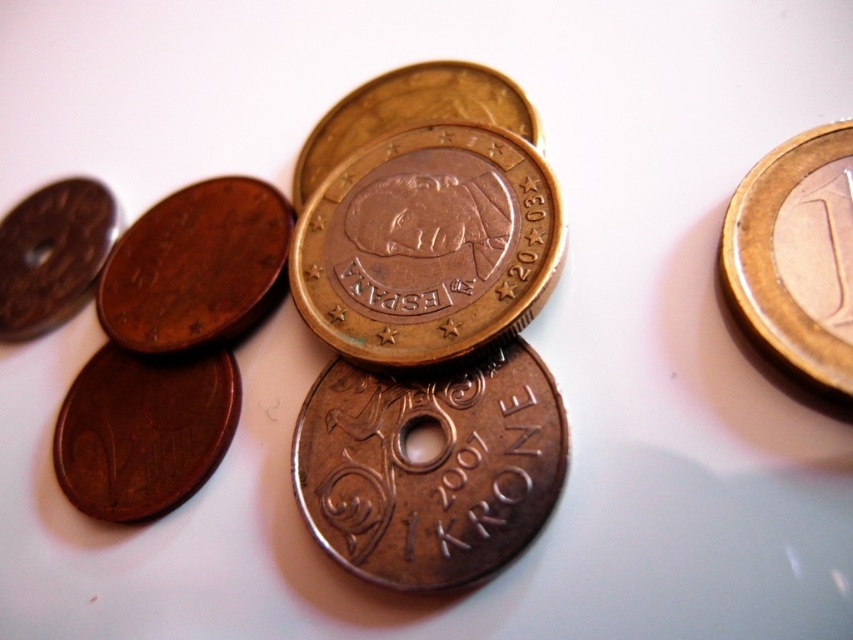
Question: Which object appears closest to the camera in this image?

Choices:
 (A) matte brown coin at left
 (B) copper-bronze coin at center

Answer: (B)

Question: Which of these objects is positioned farthest from the bronze/copper coin at center?

Choices:
 (A) bronze metallic coin at center
 (B) brass/bronze coin at lower left
 (C) matte copper coin at center-left
 (D) matte brown coin at left

Answer: (D)

Question: Is bronze/copper coin at center positioned in front of matte brown coin at left?

Choices:
 (A) no
 (B) yes

Answer: (B)

Question: Can you confirm if gold metallic coin at upper right is wider than matte brown coin at left?

Choices:
 (A) yes
 (B) no

Answer: (B)

Question: Does gold metallic coin at upper right appear over bronze metallic coin at center?

Choices:
 (A) no
 (B) yes

Answer: (A)

Question: Which of the following is the closest to the observer?

Choices:
 (A) matte brown coin at left
 (B) bronze/copper coin at center

Answer: (B)